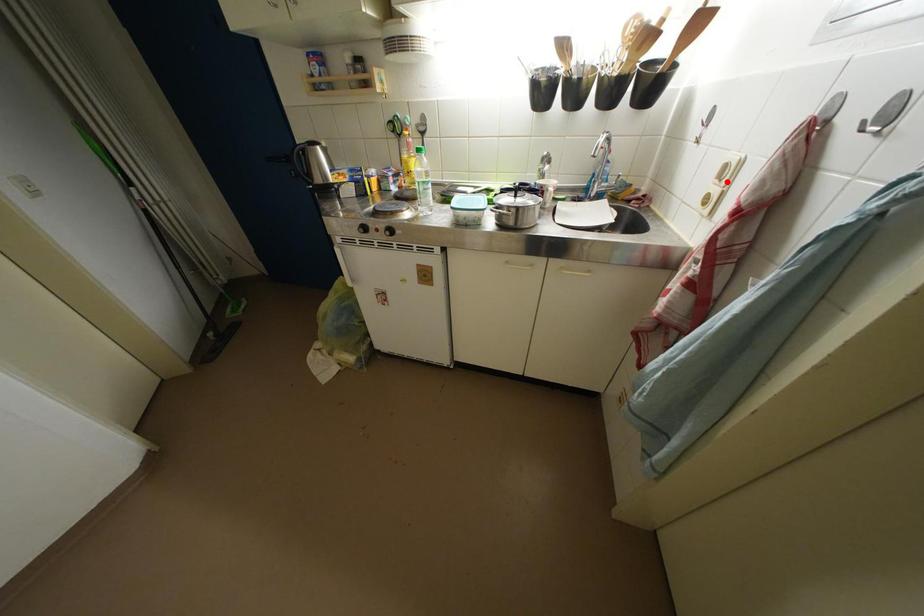
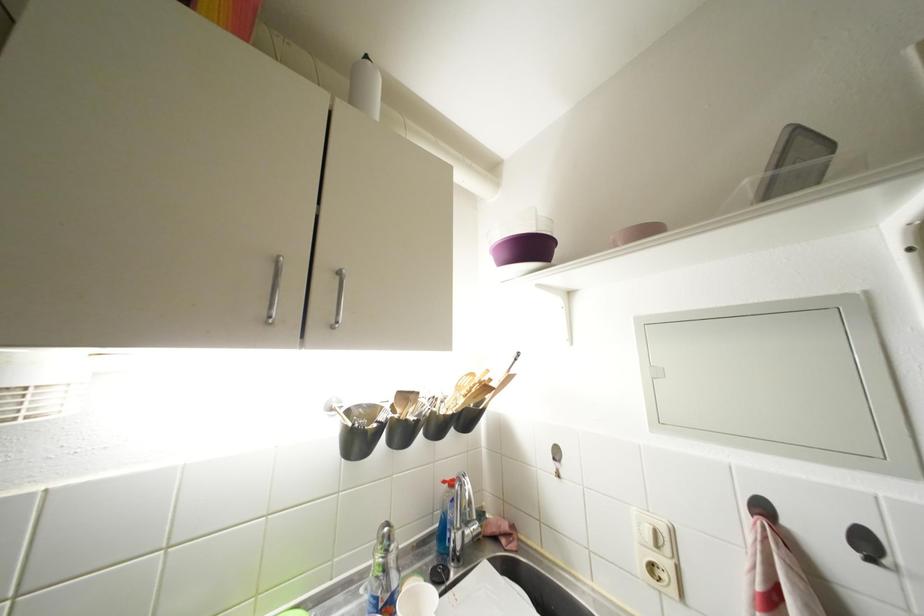
Where in the second image is the point corresponding to the highlighted location from the first image?

(663, 549)